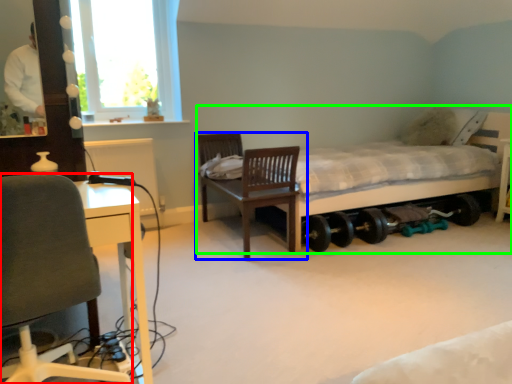
Question: Based on their relative distances, which object is nearer to chair (highlighted by a red box)? Choose from chair (highlighted by a blue box) and bed (highlighted by a green box).

Choices:
 (A) chair
 (B) bed

Answer: (A)